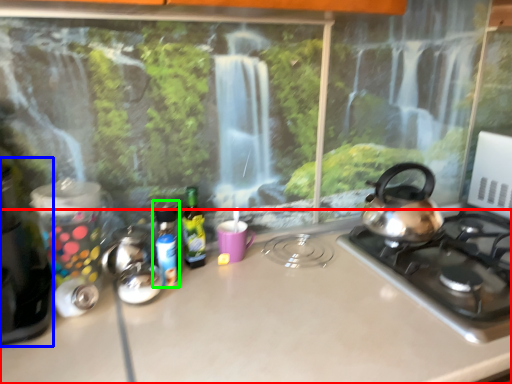
Question: Considering the real-world distances, which object is farthest from countertop (highlighted by a red box)? appliance (highlighted by a blue box) or bottle (highlighted by a green box)?

Choices:
 (A) appliance
 (B) bottle

Answer: (A)